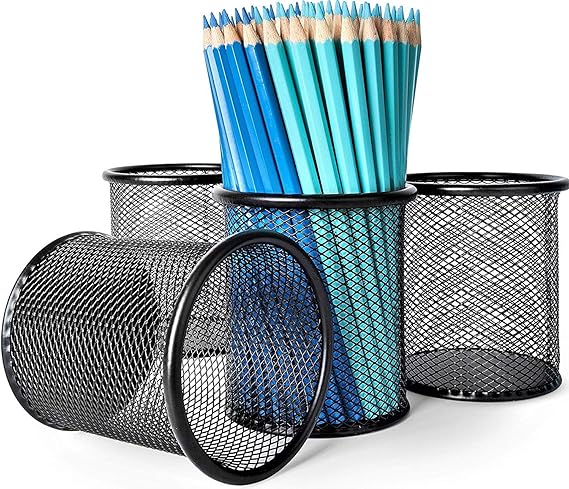
I want to click on black metal bins, so click(170, 382), click(328, 201), click(180, 180), click(490, 188).